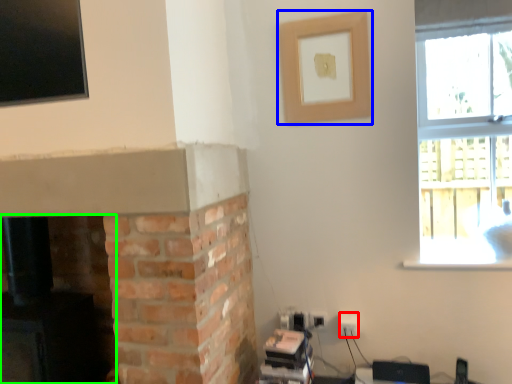
Question: Which object is positioned farthest from electric outlet (highlighted by a red box)? Select from picture frame (highlighted by a blue box) and fireplace (highlighted by a green box).

Choices:
 (A) picture frame
 (B) fireplace

Answer: (B)